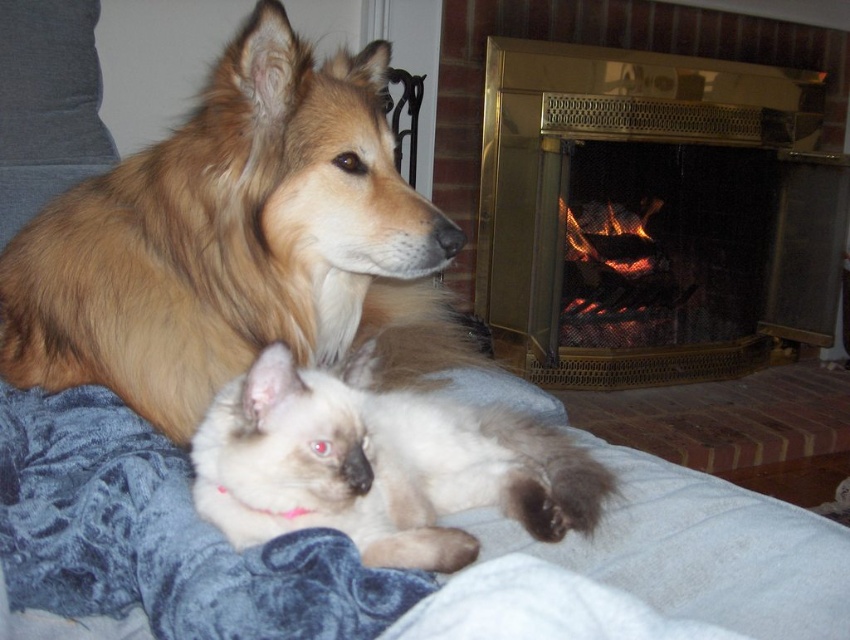
Question: Does golden fur dog at upper left appear on the right side of gold brass fireplace at upper right?

Choices:
 (A) yes
 (B) no

Answer: (B)

Question: Which point is farther to the camera?

Choices:
 (A) golden fur dog at upper left
 (B) gold brass fireplace at upper right

Answer: (B)

Question: Which point is farther to the camera?

Choices:
 (A) (180, 211)
 (B) (252, 364)

Answer: (A)

Question: Which of these objects is positioned closest to the silky white cat at center?

Choices:
 (A) gold brass fireplace at upper right
 (B) golden fur dog at upper left

Answer: (B)

Question: Is golden fur dog at upper left further to the viewer compared to silky white cat at center?

Choices:
 (A) yes
 (B) no

Answer: (A)

Question: Is golden fur dog at upper left below gold brass fireplace at upper right?

Choices:
 (A) no
 (B) yes

Answer: (B)